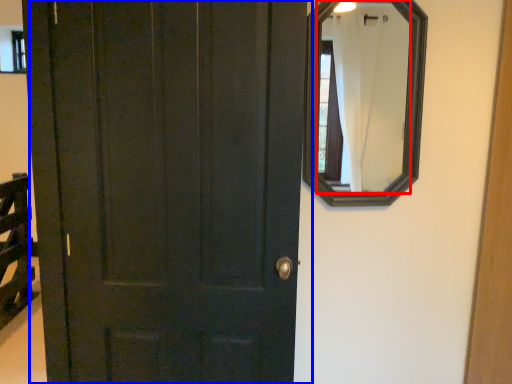
Question: Which object is closer to the camera taking this photo, mirror (highlighted by a red box) or door (highlighted by a blue box)?

Choices:
 (A) mirror
 (B) door

Answer: (B)